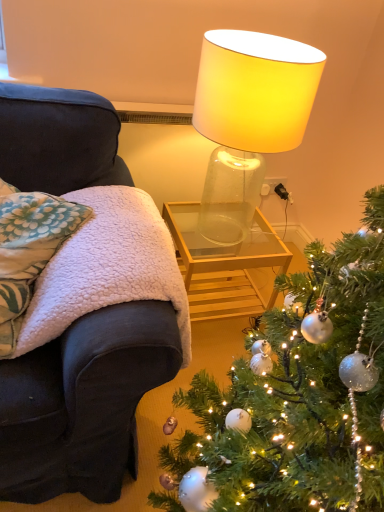
Question: Are white fleece blanket at left and transparent glass table at center making contact?

Choices:
 (A) no
 (B) yes

Answer: (A)

Question: Does white fleece blanket at left have a smaller size compared to transparent glass table at center?

Choices:
 (A) yes
 (B) no

Answer: (B)

Question: Can you confirm if white fleece blanket at left is thinner than transparent glass table at center?

Choices:
 (A) yes
 (B) no

Answer: (B)

Question: Is white fleece blanket at left facing away from transparent glass table at center?

Choices:
 (A) no
 (B) yes

Answer: (A)

Question: From the image's perspective, does white fleece blanket at left appear higher than transparent glass table at center?

Choices:
 (A) yes
 (B) no

Answer: (A)

Question: Can you confirm if white fleece blanket at left is taller than transparent glass table at center?

Choices:
 (A) yes
 (B) no

Answer: (B)

Question: Does white fleece blanket at left have a larger size compared to fluffy white pillow at left?

Choices:
 (A) yes
 (B) no

Answer: (A)

Question: From a real-world perspective, is white fleece blanket at left located higher than fluffy white pillow at left?

Choices:
 (A) yes
 (B) no

Answer: (B)

Question: Can you confirm if white fleece blanket at left is shorter than fluffy white pillow at left?

Choices:
 (A) no
 (B) yes

Answer: (A)

Question: Is white fleece blanket at left behind fluffy white pillow at left?

Choices:
 (A) yes
 (B) no

Answer: (B)

Question: Considering the relative positions of white fleece blanket at left and fluffy white pillow at left in the image provided, is white fleece blanket at left to the left of fluffy white pillow at left from the viewer's perspective?

Choices:
 (A) no
 (B) yes

Answer: (A)

Question: From the image's perspective, is white fleece blanket at left over fluffy white pillow at left?

Choices:
 (A) no
 (B) yes

Answer: (A)

Question: Does transparent glass table at center have a lesser width compared to fluffy white pillow at left?

Choices:
 (A) no
 (B) yes

Answer: (A)